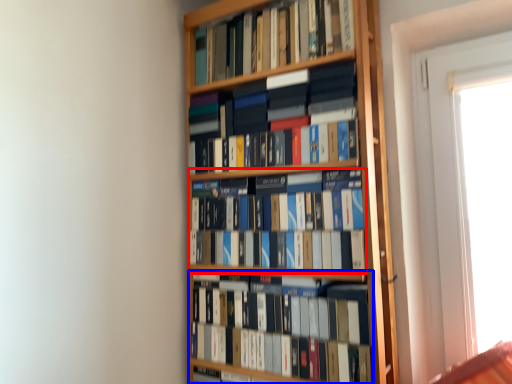
Question: Which of the following is the farthest to the observer, book (highlighted by a red box) or book (highlighted by a blue box)?

Choices:
 (A) book
 (B) book

Answer: (A)